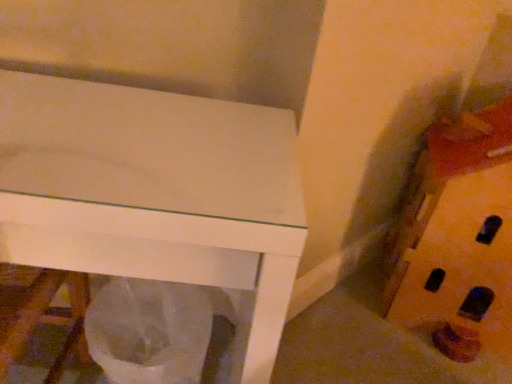
Question: Is wooden block at right shorter than white plastic bag at lower center?

Choices:
 (A) yes
 (B) no

Answer: (B)

Question: Is wooden block at right positioned with its back to white plastic bag at lower center?

Choices:
 (A) no
 (B) yes

Answer: (A)

Question: Can you confirm if wooden block at right is wider than white plastic bag at lower center?

Choices:
 (A) no
 (B) yes

Answer: (B)

Question: Considering the relative positions of wooden block at right and white plastic bag at lower center in the image provided, is wooden block at right to the left of white plastic bag at lower center from the viewer's perspective?

Choices:
 (A) no
 (B) yes

Answer: (A)

Question: Would you say white plastic bag at lower center is part of wooden block at right's contents?

Choices:
 (A) yes
 (B) no

Answer: (B)

Question: From a real-world perspective, is wooden block at right physically below white plastic bag at lower center?

Choices:
 (A) no
 (B) yes

Answer: (A)

Question: Can we say white plastic bag at lower center lies outside wooden block at right?

Choices:
 (A) yes
 (B) no

Answer: (A)

Question: Can you confirm if white plastic bag at lower center is positioned to the right of wooden block at right?

Choices:
 (A) no
 (B) yes

Answer: (A)

Question: Is white plastic bag at lower center aimed at wooden block at right?

Choices:
 (A) no
 (B) yes

Answer: (A)

Question: Can you confirm if white plastic bag at lower center is taller than wooden block at right?

Choices:
 (A) yes
 (B) no

Answer: (B)

Question: Are white plastic bag at lower center and wooden block at right making contact?

Choices:
 (A) yes
 (B) no

Answer: (B)

Question: Does white plastic bag at lower center have a smaller size compared to wooden block at right?

Choices:
 (A) yes
 (B) no

Answer: (A)

Question: Is wooden block at right wider or thinner than white plastic bag at lower center?

Choices:
 (A) thin
 (B) wide

Answer: (B)